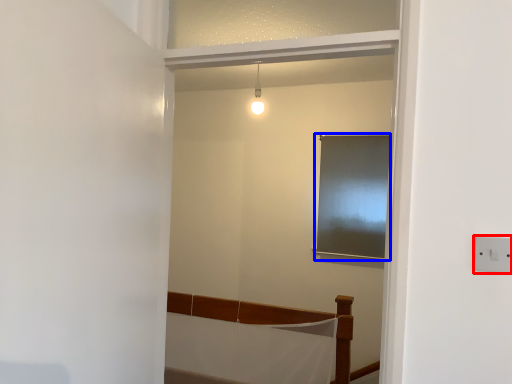
Question: Which object is closer to the camera taking this photo, electric outlet (highlighted by a red box) or window (highlighted by a blue box)?

Choices:
 (A) electric outlet
 (B) window

Answer: (A)